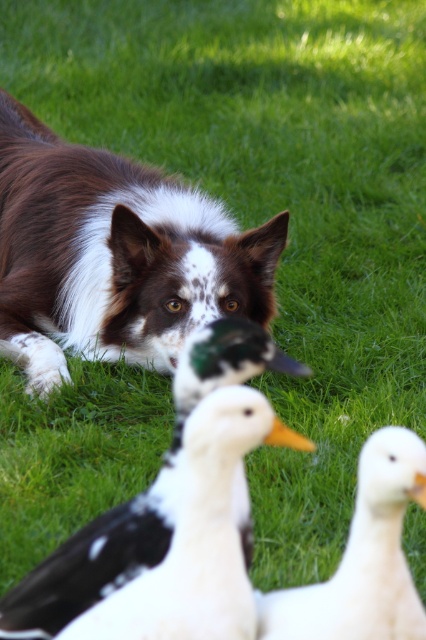
What are the coordinates of the white matte goose at center?

The white matte goose at center is located at coordinates point (198, 536).